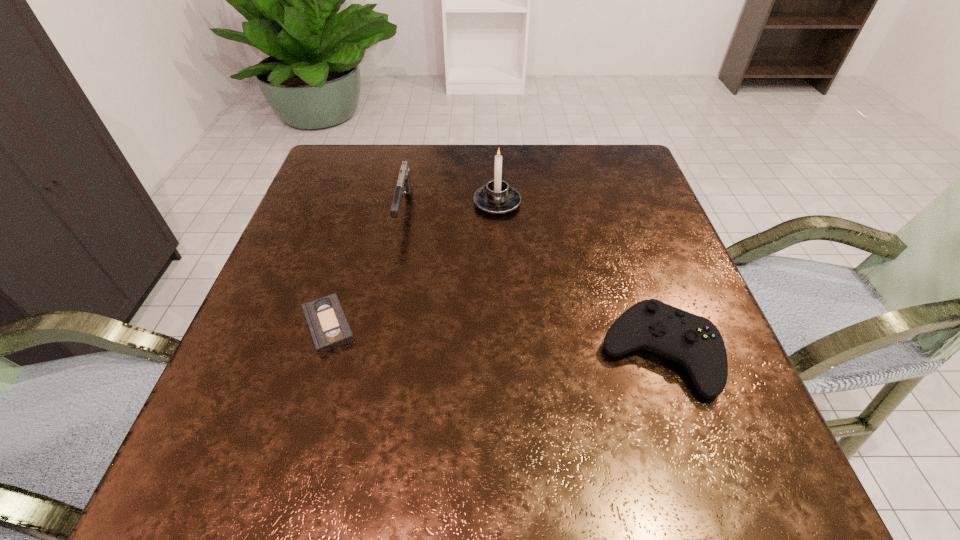
What are the coordinates of `free area in between the tallest object and the shortest object` in the screenshot? It's located at (413, 264).

The image size is (960, 540). I want to click on free space that is in between the second object from right to left and the control, so click(578, 278).

Where is `empty space between the shortest object and the second object from left to right`? The height and width of the screenshot is (540, 960). empty space between the shortest object and the second object from left to right is located at coordinates pos(366,267).

Locate an element on the screen. The height and width of the screenshot is (540, 960). free area in between the control and the tallest object is located at coordinates (578, 278).

The image size is (960, 540). Identify the location of unoccupied area between the shortest object and the second shortest object. (493, 339).

Identify the location of free point between the gun and the control. Image resolution: width=960 pixels, height=540 pixels. (531, 281).

Find the location of a particular element. This screenshot has height=540, width=960. free space between the candle holder and the leftmost object is located at coordinates (413, 264).

The height and width of the screenshot is (540, 960). I want to click on free spot between the leftmost object and the candle holder, so click(413, 264).

Locate an element on the screen. Image resolution: width=960 pixels, height=540 pixels. free space that is in between the leftmost object and the second object from right to left is located at coordinates (413, 264).

Where is `object that ranks as the closest to the gun`? object that ranks as the closest to the gun is located at coordinates (497, 197).